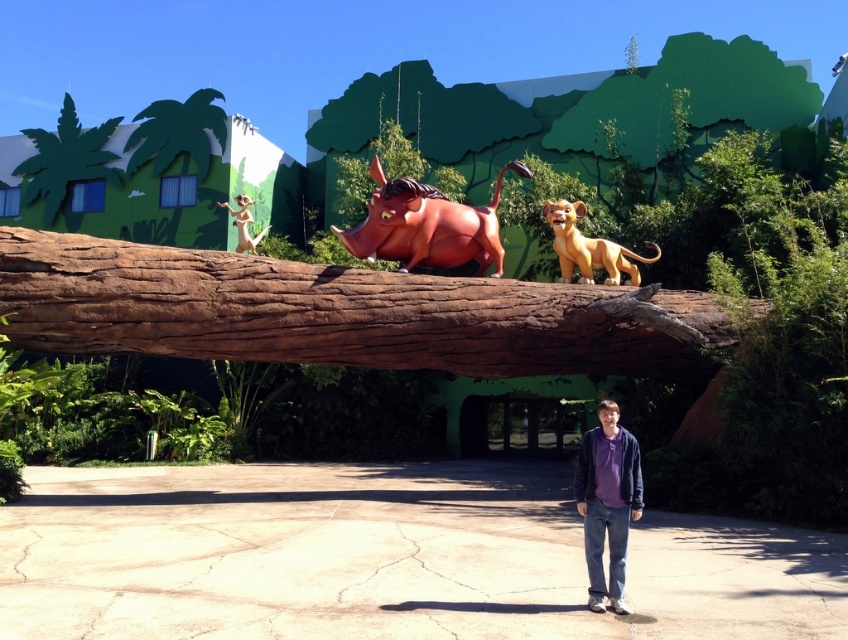
You are a park visitor holding a 10 meter long kite string. You are standing near the golden matte lion at center and want to fly a kite above the green painted palm tree at upper left. Can you reach the palm tree with your kite string?

The green painted palm tree at upper left is 15.20 meters from the golden matte lion at center. Since your kite string is only 10 meters long, it is not long enough to reach the palm tree.

You are an artist trying to recreate this scene. You have a limited amount of silver paint. The shiny silver monkey at upper left needs to be painted. Given that the green painted palm tree at upper left requires more silver paint due to its larger size, will you have enough paint for both?

The green painted palm tree at upper left is wider than the shiny silver monkey at upper left, so it requires more silver paint. Since the artist has limited paint, they might not have enough for both.

You are a maintenance worker needing to reach both the green painted palm tree at upper left and the shiny silver monkey at upper left. Given that your ladder can extend up to 6 meters, can you safely reach both objects with a single ladder placement?

The distance between the green painted palm tree at upper left and the shiny silver monkey at upper left is 6.73 meters. Since your ladder extends only 6 meters, you cannot safely reach both objects with a single ladder placement as the distance exceeds the ladder length.